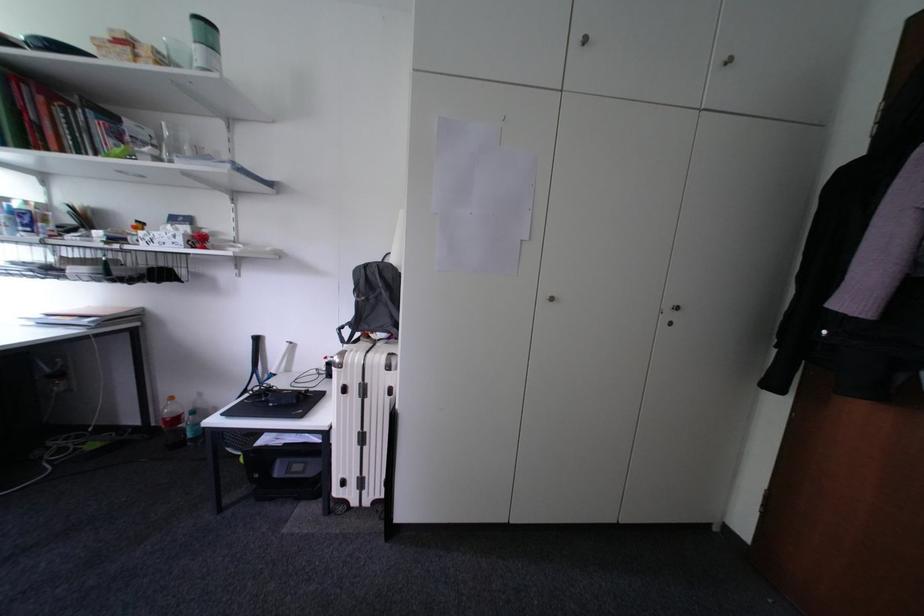
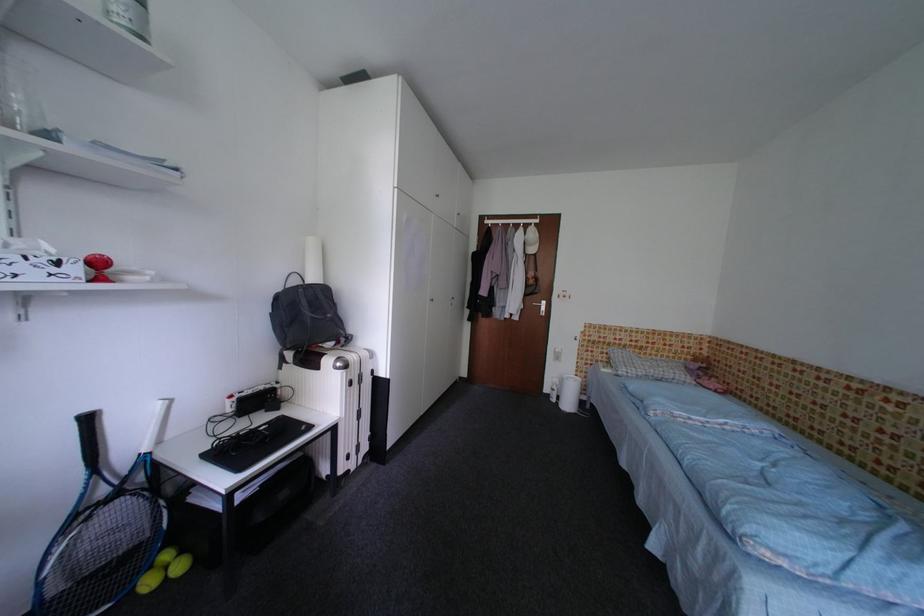
Where in the second image is the point corresponding to point 265,342 from the first image?

(98, 422)